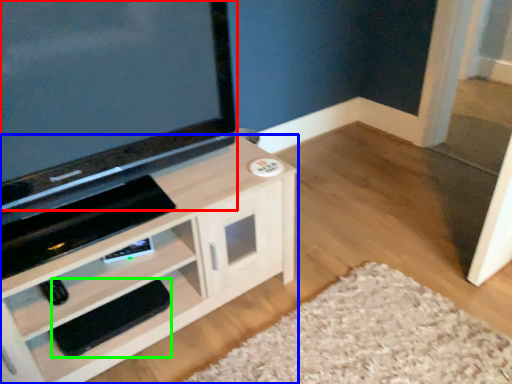
Question: Which object is positioned farthest from television (highlighted by a red box)? Select from cabinetry (highlighted by a blue box) and footrest (highlighted by a green box).

Choices:
 (A) cabinetry
 (B) footrest

Answer: (B)